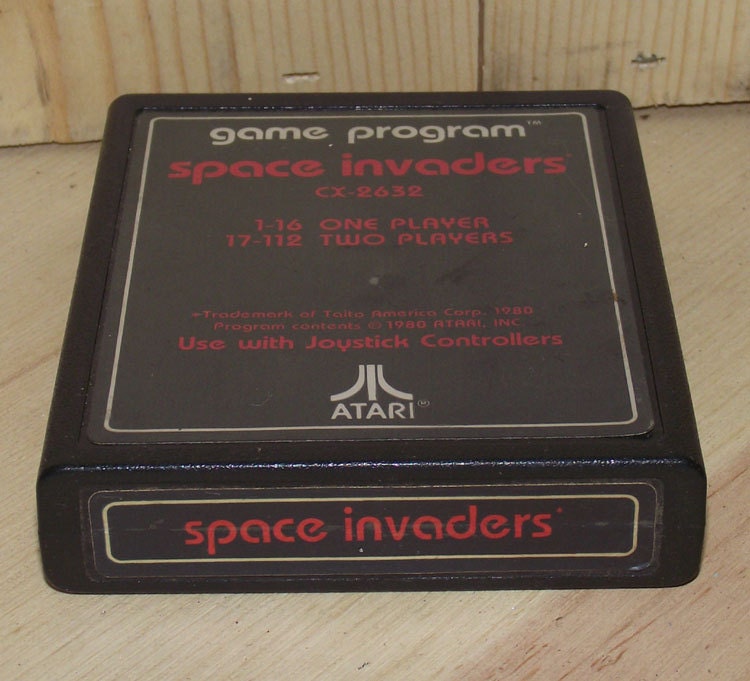
Locate an element on the screen. The width and height of the screenshot is (750, 681). wall is located at coordinates (109, 58), (543, 33).